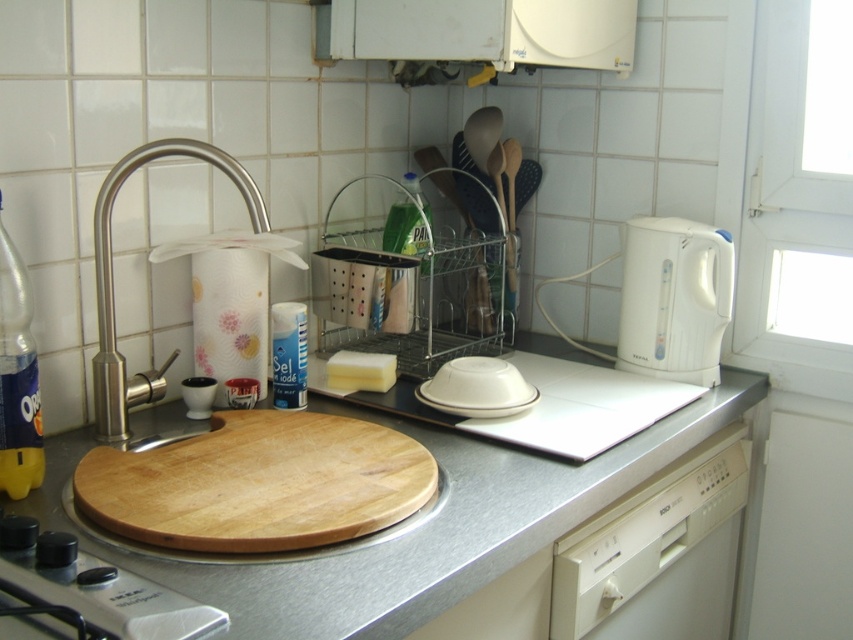
From the picture: Does natural wood cutting board at center have a greater width compared to brushed metal faucet at left?

Yes, natural wood cutting board at center is wider than brushed metal faucet at left.

Can you confirm if natural wood cutting board at center is thinner than brushed metal faucet at left?

No.

Image resolution: width=853 pixels, height=640 pixels. What do you see at coordinates (258, 483) in the screenshot?
I see `natural wood cutting board at center` at bounding box center [258, 483].

Where is `natural wood cutting board at center`? Image resolution: width=853 pixels, height=640 pixels. natural wood cutting board at center is located at coordinates (258, 483).

This screenshot has height=640, width=853. Describe the element at coordinates (674, 298) in the screenshot. I see `white plastic kettle at right` at that location.

Who is more distant from viewer, (x=663, y=364) or (x=96, y=248)?

Positioned behind is point (x=663, y=364).

Locate an element on the screen. white plastic kettle at right is located at coordinates (674, 298).

Is white plastic exhaust hood at upper center to the right of white glossy plate at center from the viewer's perspective?

Correct, you'll find white plastic exhaust hood at upper center to the right of white glossy plate at center.

Is white plastic exhaust hood at upper center positioned behind white glossy plate at center?

Yes.

Which is behind, point (552, 28) or point (520, 404)?

The point (552, 28) is behind.

The width and height of the screenshot is (853, 640). In order to click on white plastic exhaust hood at upper center in this screenshot , I will do `click(480, 32)`.